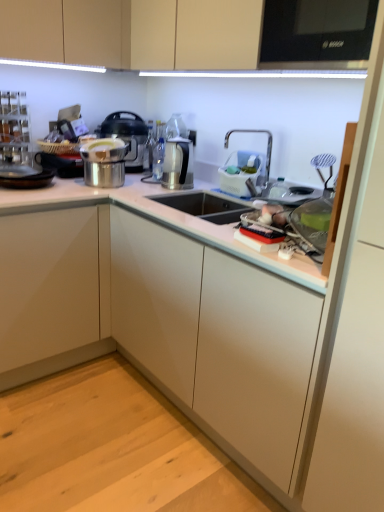
Question: Considering the relative positions of white plastic dish rack at upper right, acting as the 1th appliance starting from the right, and satin silver kettle at center, the 2th appliance positioned from the right, in the image provided, is white plastic dish rack at upper right, acting as the 1th appliance starting from the right, behind satin silver kettle at center, the 2th appliance positioned from the right,?

Choices:
 (A) no
 (B) yes

Answer: (A)

Question: Does white plastic dish rack at upper right, acting as the 1th appliance starting from the right, have a lesser height compared to satin silver kettle at center, the first appliance positioned from the left?

Choices:
 (A) no
 (B) yes

Answer: (B)

Question: Does white plastic dish rack at upper right, which ranks as the 2th appliance in left-to-right order, have a smaller size compared to satin silver kettle at center, the first appliance positioned from the left?

Choices:
 (A) yes
 (B) no

Answer: (A)

Question: Is white plastic dish rack at upper right, which ranks as the 2th appliance in left-to-right order, to the left of satin silver kettle at center, the 2th appliance positioned from the right, from the viewer's perspective?

Choices:
 (A) no
 (B) yes

Answer: (A)

Question: From a real-world perspective, does white plastic dish rack at upper right, which ranks as the 2th appliance in left-to-right order, stand above satin silver kettle at center, the first appliance positioned from the left?

Choices:
 (A) no
 (B) yes

Answer: (B)

Question: Is matte beige cabinets at upper center, the second cabinetry when ordered from left to right, positioned with its back to white plastic dish rack at upper right, which ranks as the 2th appliance in left-to-right order?

Choices:
 (A) no
 (B) yes

Answer: (A)

Question: Is white plastic dish rack at upper right, acting as the 1th appliance starting from the right, inside matte beige cabinets at upper center, the 1th cabinetry from the top?

Choices:
 (A) no
 (B) yes

Answer: (A)

Question: From the image's perspective, is matte beige cabinets at upper center, which is counted as the 2th cabinetry, starting from the bottom, below white plastic dish rack at upper right, which ranks as the 2th appliance in left-to-right order?

Choices:
 (A) yes
 (B) no

Answer: (B)

Question: Can you confirm if matte beige cabinets at upper center, the 1th cabinetry from the top, is wider than white plastic dish rack at upper right, acting as the 1th appliance starting from the right?

Choices:
 (A) yes
 (B) no

Answer: (A)

Question: Considering the relative positions of matte beige cabinets at upper center, the second cabinetry when ordered from left to right, and white plastic dish rack at upper right, which ranks as the 2th appliance in left-to-right order, in the image provided, is matte beige cabinets at upper center, the second cabinetry when ordered from left to right, to the right of white plastic dish rack at upper right, which ranks as the 2th appliance in left-to-right order, from the viewer's perspective?

Choices:
 (A) yes
 (B) no

Answer: (B)

Question: Can you confirm if matte beige cabinets at upper center, the 1th cabinetry from the top, is thinner than white plastic dish rack at upper right, acting as the 1th appliance starting from the right?

Choices:
 (A) yes
 (B) no

Answer: (B)

Question: Is stainless steel pot at center completely or partially outside of satin silver kettle at center, the first appliance positioned from the left?

Choices:
 (A) no
 (B) yes

Answer: (B)